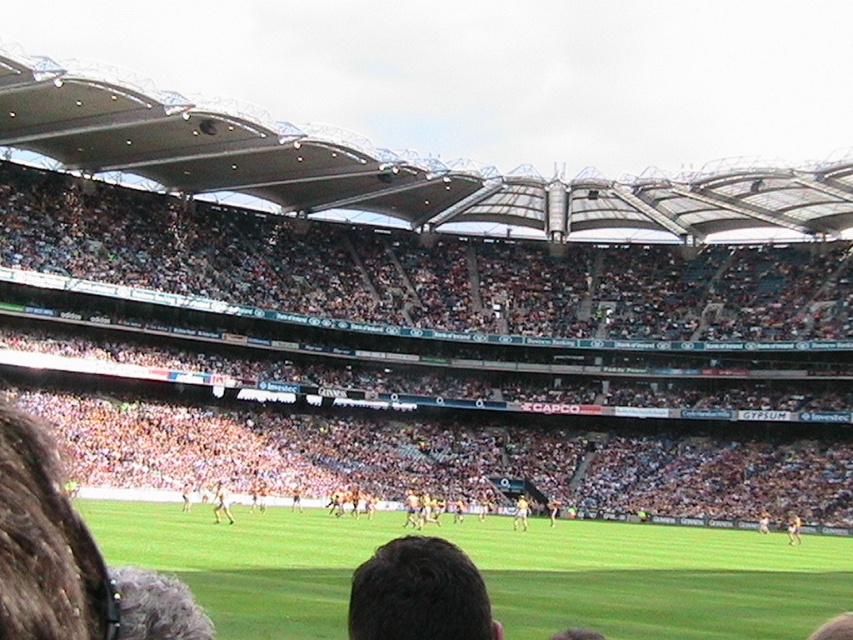
Question: Can you confirm if orange plastic seats at center is thinner than light brown leather shoe at center?

Choices:
 (A) no
 (B) yes

Answer: (A)

Question: Which object appears farthest from the camera in this image?

Choices:
 (A) dark brown hair at center
 (B) brown leather jacket at center
 (C) orange plastic seats at center

Answer: (B)

Question: Which object is farther from the camera taking this photo?

Choices:
 (A) dark brown hair at center
 (B) light brown leather person at center
 (C) brown leather jacket at center

Answer: (C)

Question: Does green grass football field at center appear on the right side of dark brown hair at center?

Choices:
 (A) no
 (B) yes

Answer: (B)

Question: Is green grass football field at center positioned in front of dark brown hair at center?

Choices:
 (A) no
 (B) yes

Answer: (A)

Question: Which object appears farthest from the camera in this image?

Choices:
 (A) orange plastic seats at center
 (B) light brown leather person at center
 (C) light brown leather shoe at center
 (D) brown leather jacket at center

Answer: (C)